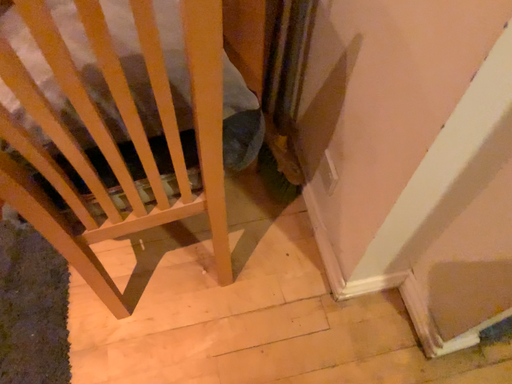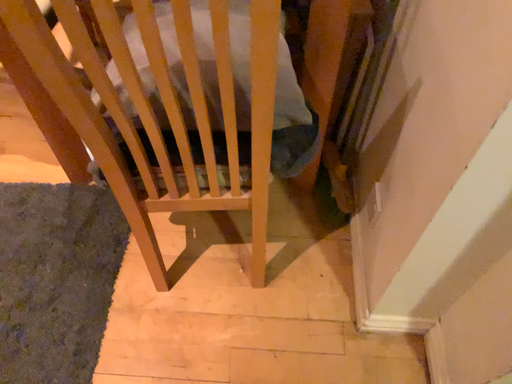
Question: How did the camera likely rotate when shooting the video?

Choices:
 (A) rotated right
 (B) rotated left

Answer: (B)